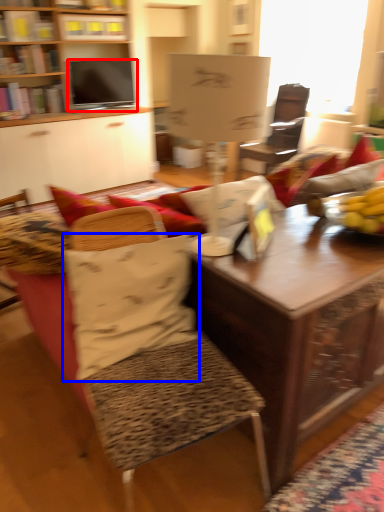
Question: Which object appears closest to the camera in this image, television (highlighted by a red box) or pillow (highlighted by a blue box)?

Choices:
 (A) television
 (B) pillow

Answer: (B)